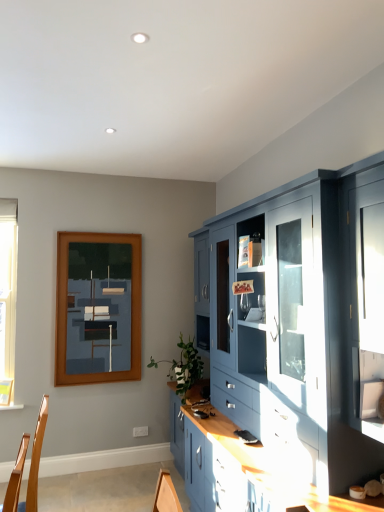
Question: From a real-world perspective, is matte blue cabinet at right physically located above or below wooden picture frame at upper left?

Choices:
 (A) below
 (B) above

Answer: (A)

Question: Visually, is matte blue cabinet at right positioned to the left or to the right of wooden picture frame at upper left?

Choices:
 (A) left
 (B) right

Answer: (B)

Question: In terms of width, does matte blue cabinet at right look wider or thinner when compared to wooden picture frame at upper left?

Choices:
 (A) thin
 (B) wide

Answer: (B)

Question: Considering the positions of wooden picture frame at upper left and matte blue cabinet at right in the image, is wooden picture frame at upper left bigger or smaller than matte blue cabinet at right?

Choices:
 (A) big
 (B) small

Answer: (B)

Question: Considering the positions of wooden picture frame at upper left and matte blue cabinet at right in the image, is wooden picture frame at upper left taller or shorter than matte blue cabinet at right?

Choices:
 (A) short
 (B) tall

Answer: (A)

Question: Is wooden picture frame at upper left wider or thinner than matte blue cabinet at right?

Choices:
 (A) thin
 (B) wide

Answer: (A)

Question: In the image, is wooden picture frame at upper left on the left side or the right side of matte blue cabinet at right?

Choices:
 (A) right
 (B) left

Answer: (B)